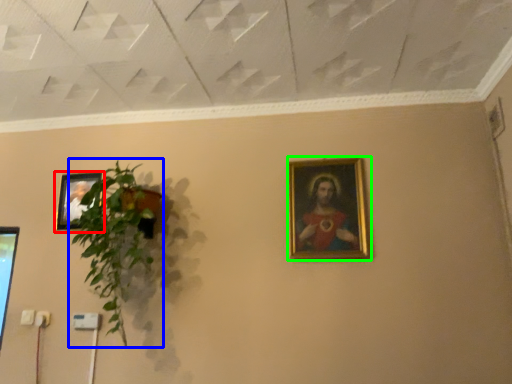
Question: Which is farther away from picture frame (highlighted by a red box)? houseplant (highlighted by a blue box) or picture frame (highlighted by a green box)?

Choices:
 (A) houseplant
 (B) picture frame

Answer: (B)